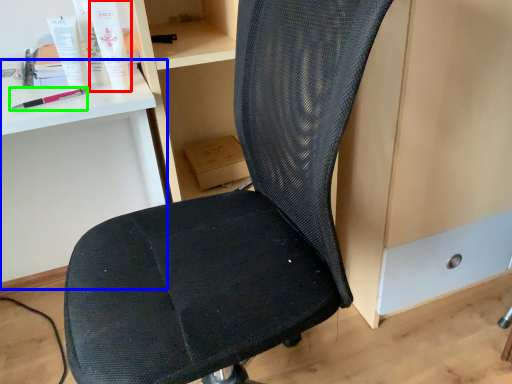
Question: Considering the real-world distances, which object is closest to toiletry (highlighted by a red box)? computer desk (highlighted by a blue box) or equipment (highlighted by a green box).

Choices:
 (A) computer desk
 (B) equipment

Answer: (B)